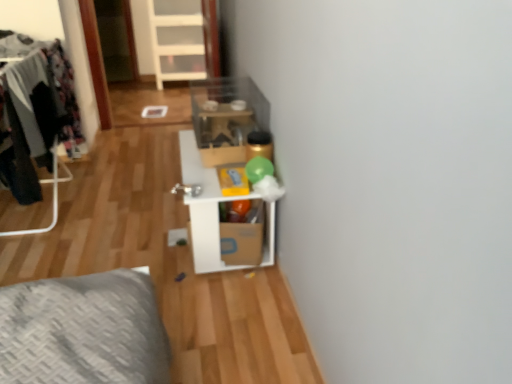
In order to click on vacant area in front of cardboard box at center in this screenshot , I will do `click(234, 292)`.